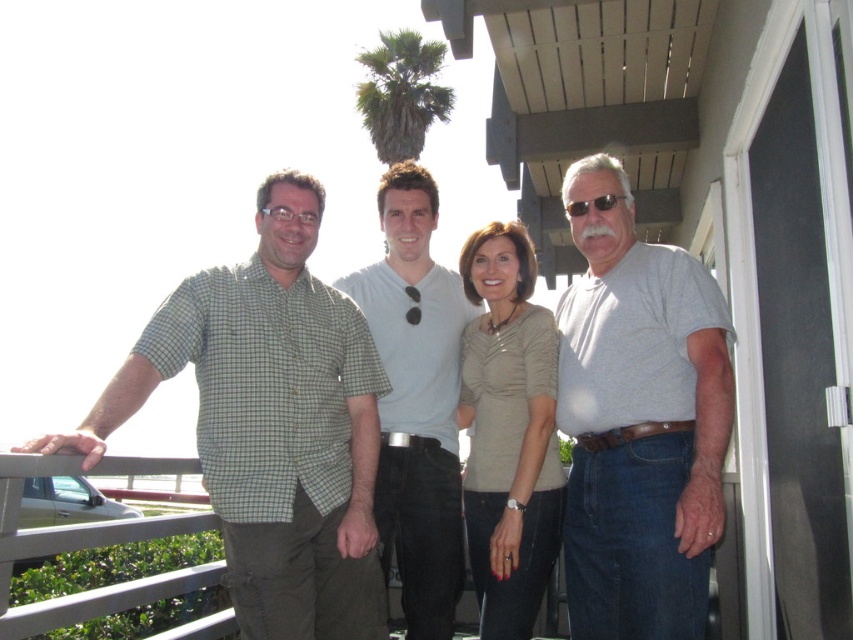
Identify the location of white cotton t-shirt at center. (416, 401).

Does point (294, 476) come behind point (425, 248)?

No, (294, 476) is in front of (425, 248).

From the picture: Which of these two, green checkered shirt at left or white cotton t-shirt at center, stands shorter?

green checkered shirt at left is shorter.

Between point (373, 429) and point (424, 228), which one is positioned behind?

Positioned behind is point (424, 228).

At what (x,y) coordinates should I click in order to perform the action: click on green checkered shirt at left. Please return your answer as a coordinate pair (x, y). This screenshot has width=853, height=640. Looking at the image, I should click on (271, 424).

Between gray matte t-shirt at right and matte beige blouse at center, which one is positioned higher?

gray matte t-shirt at right

Describe the element at coordinates (637, 420) in the screenshot. I see `gray matte t-shirt at right` at that location.

Does point (630, 484) come farther from viewer compared to point (552, 368)?

No, (630, 484) is closer to viewer.

This screenshot has height=640, width=853. I want to click on gray matte t-shirt at right, so click(x=637, y=420).